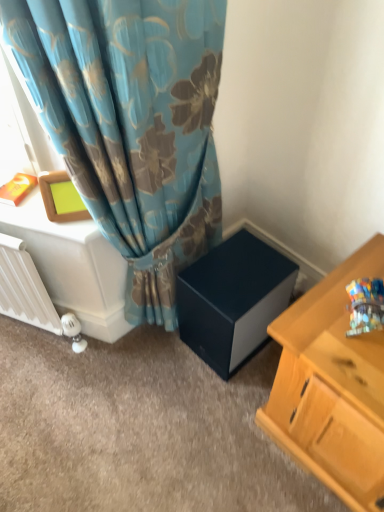
Question: Would you say white glossy table at left is outside matte black cube at center?

Choices:
 (A) yes
 (B) no

Answer: (A)

Question: Is matte black cube at center at the back of white glossy table at left?

Choices:
 (A) yes
 (B) no

Answer: (B)

Question: Is white glossy table at left not close to matte black cube at center?

Choices:
 (A) no
 (B) yes

Answer: (A)

Question: Is white glossy table at left bigger than matte black cube at center?

Choices:
 (A) yes
 (B) no

Answer: (A)

Question: Is white glossy table at left with matte black cube at center?

Choices:
 (A) yes
 (B) no

Answer: (B)

Question: Looking at their shapes, would you say matte black cube at center is wider or thinner than white matte radiator at lower left?

Choices:
 (A) wide
 (B) thin

Answer: (A)

Question: Is point (233, 352) closer or farther from the camera than point (34, 282)?

Choices:
 (A) farther
 (B) closer

Answer: (A)

Question: Choose the correct answer: Is matte black cube at center inside white matte radiator at lower left or outside it?

Choices:
 (A) outside
 (B) inside

Answer: (A)

Question: Is matte black cube at center taller or shorter than white matte radiator at lower left?

Choices:
 (A) tall
 (B) short

Answer: (B)

Question: Is point (18, 241) positioned closer to the camera than point (193, 328)?

Choices:
 (A) closer
 (B) farther

Answer: (A)

Question: In the image, is white matte radiator at lower left on the left side or the right side of matte black cube at center?

Choices:
 (A) left
 (B) right

Answer: (A)

Question: In terms of height, does white matte radiator at lower left look taller or shorter compared to matte black cube at center?

Choices:
 (A) short
 (B) tall

Answer: (B)

Question: In the image, is white matte radiator at lower left positioned in front of or behind matte black cube at center?

Choices:
 (A) behind
 (B) front

Answer: (B)

Question: From a real-world perspective, is white glossy table at left physically located above or below matte black cube at center?

Choices:
 (A) below
 (B) above

Answer: (B)

Question: Visually, is white glossy table at left positioned to the left or to the right of matte black cube at center?

Choices:
 (A) left
 (B) right

Answer: (A)